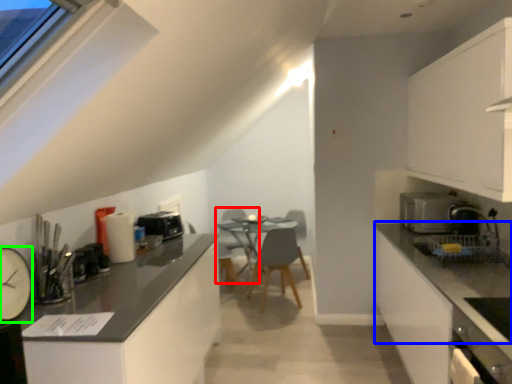
Question: Based on their relative distances, which object is nearer to swivel chair (highlighted by a red box)? Choose from countertop (highlighted by a blue box) and appliance (highlighted by a green box).

Choices:
 (A) countertop
 (B) appliance

Answer: (A)